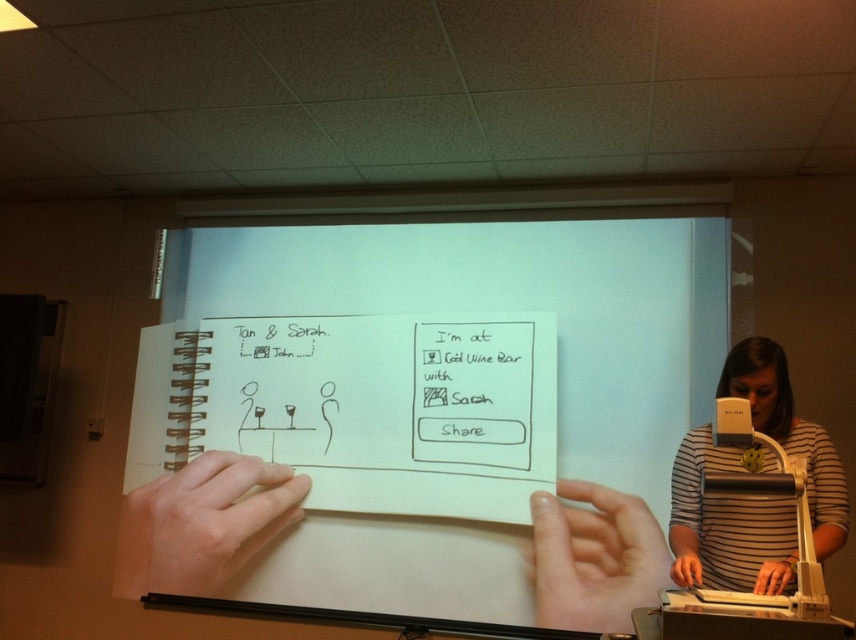
You are a GUI agent. You are given a task and a screenshot of the screen. Output one action in this format:
    pyautogui.click(x=<x>, y=<y>)
    Task: Click on the white paper notebook at center
    
    Given the screenshot: What is the action you would take?
    pyautogui.click(x=360, y=406)

Does striped cotton shirt at lower right appear over white paper notepad at lower right?

Yes.

Is point (729, 516) positioned before point (718, 604)?

No, it is behind (718, 604).

The height and width of the screenshot is (640, 856). I want to click on striped cotton shirt at lower right, so click(x=721, y=522).

The image size is (856, 640). What do you see at coordinates (203, 524) in the screenshot?
I see `pale skin at center` at bounding box center [203, 524].

Is point (167, 563) closer to camera compared to point (788, 566)?

No, (167, 563) is further to viewer.

Locate an element on the screen. This screenshot has width=856, height=640. pale skin at center is located at coordinates pos(203,524).